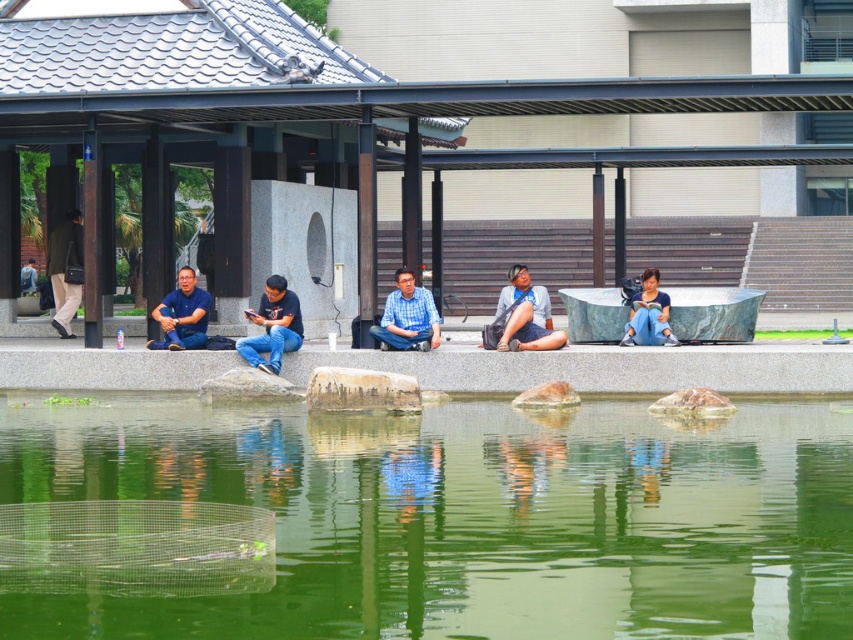
Does matte blue jeans at center appear on the left side of blue fabric pants at center?

Yes, matte blue jeans at center is to the left of blue fabric pants at center.

Between point (281, 348) and point (637, 320), which one is positioned behind?

The point (637, 320) is behind.

Does point (267, 364) come closer to viewer compared to point (643, 332)?

Yes, it is in front of point (643, 332).

Where is `matte blue jeans at center`? The width and height of the screenshot is (853, 640). matte blue jeans at center is located at coordinates (273, 326).

Describe the element at coordinates (407, 316) in the screenshot. I see `blue checkered shirt at center` at that location.

Between blue checkered shirt at center and blue fabric pants at center, which one has less height?

Standing shorter between the two is blue fabric pants at center.

Which is in front, point (424, 346) or point (651, 307)?

Positioned in front is point (424, 346).

Locate an element on the screen. The image size is (853, 640). blue checkered shirt at center is located at coordinates (407, 316).

Does green liquid water at center have a smaller size compared to gray stone ledge at center?

Actually, green liquid water at center might be larger than gray stone ledge at center.

Does green liquid water at center lie behind gray stone ledge at center?

No, it is not.

Which is in front, point (316, 476) or point (647, 349)?

Point (316, 476) is more forward.

Find the location of a particular element. The width and height of the screenshot is (853, 640). green liquid water at center is located at coordinates (460, 518).